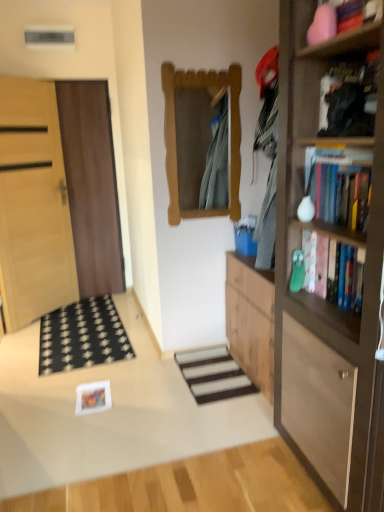
Where is `blank space above brown wooden door at left, arranged as the 1th door when viewed from the right (from a real-world perspective)`? This screenshot has height=512, width=384. blank space above brown wooden door at left, arranged as the 1th door when viewed from the right (from a real-world perspective) is located at coordinates (66, 76).